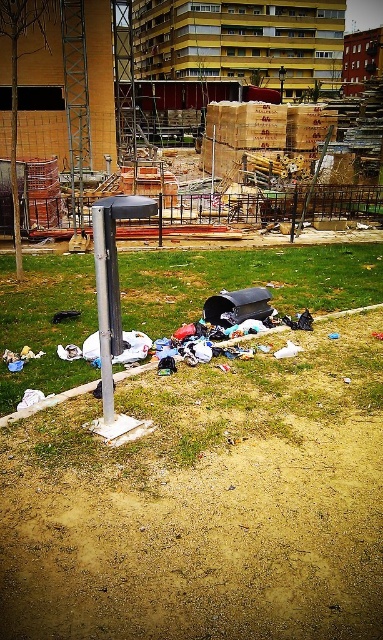
Question: Among these points, which one is nearest to the camera?

Choices:
 (A) (109, 336)
 (B) (358, 272)

Answer: (A)

Question: Is green grass at center wider than silver metallic pole at center?

Choices:
 (A) no
 (B) yes

Answer: (B)

Question: Which point is farther to the camera?

Choices:
 (A) silver metallic pole at center
 (B) green grass at center

Answer: (B)

Question: Where is green grass at center located in relation to silver metallic pole at center in the image?

Choices:
 (A) above
 (B) below

Answer: (A)

Question: Among these points, which one is nearest to the camera?

Choices:
 (A) (103, 372)
 (B) (338, 278)

Answer: (A)

Question: Can you confirm if green grass at center is smaller than silver metallic pole at center?

Choices:
 (A) no
 (B) yes

Answer: (A)